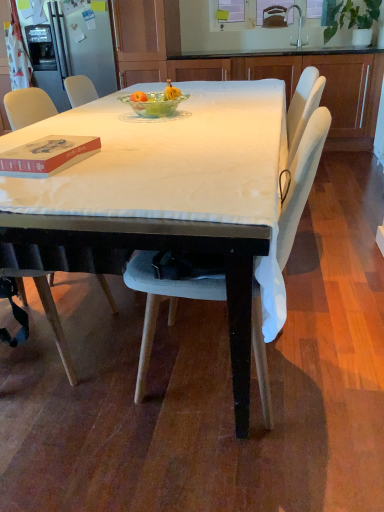
Locate an element on the screen. The width and height of the screenshot is (384, 512). vacant space to the right of light gray fabric chair at center is located at coordinates (336, 353).